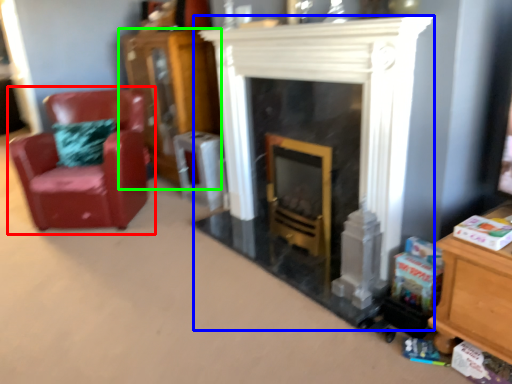
Question: Considering the real-world distances, which object is farthest from chair (highlighted by a red box)? fireplace (highlighted by a blue box) or dresser (highlighted by a green box)?

Choices:
 (A) fireplace
 (B) dresser

Answer: (A)